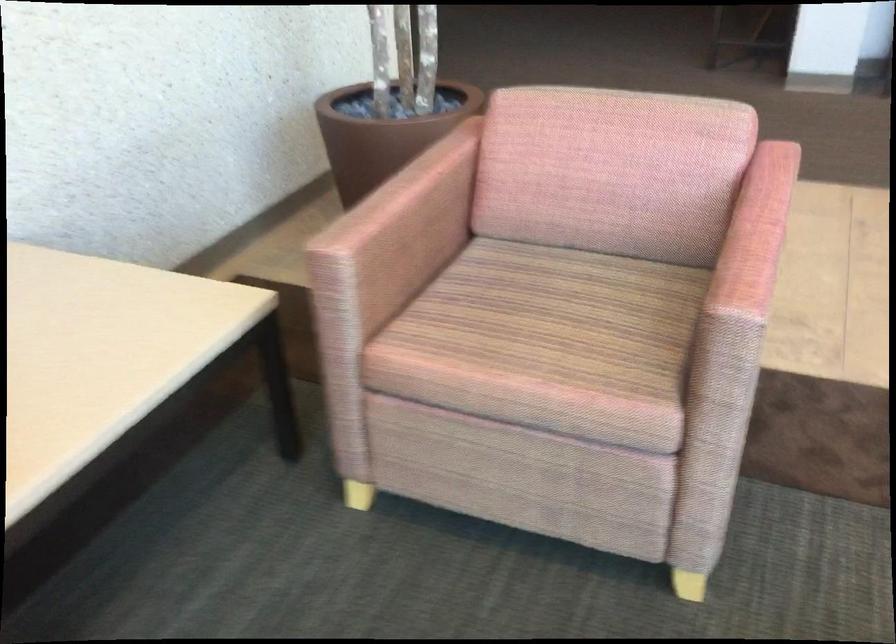
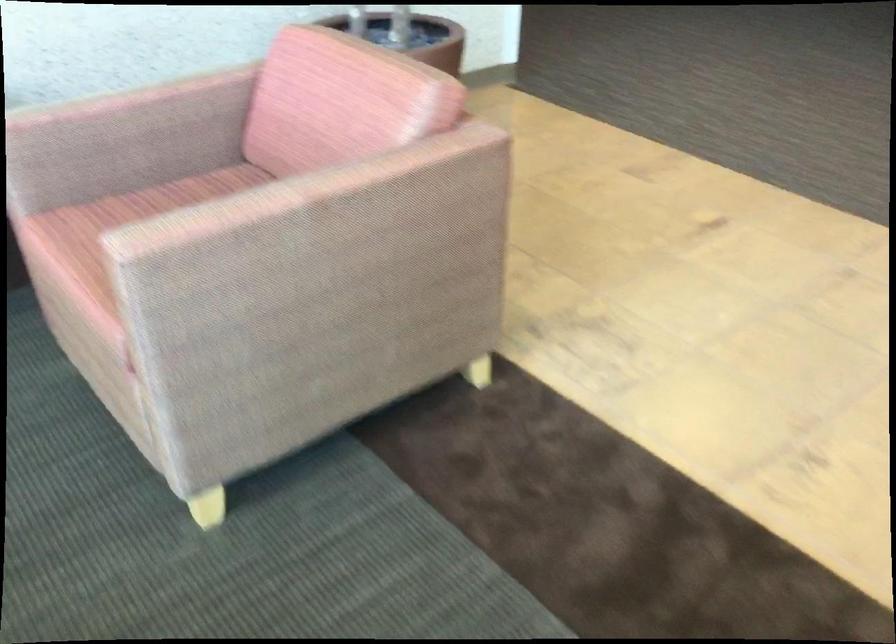
Question: The images are taken continuously from a first-person perspective. In which direction are you moving?

Choices:
 (A) Left
 (B) Right
 (C) Forward
 (D) Backward

Answer: (B)